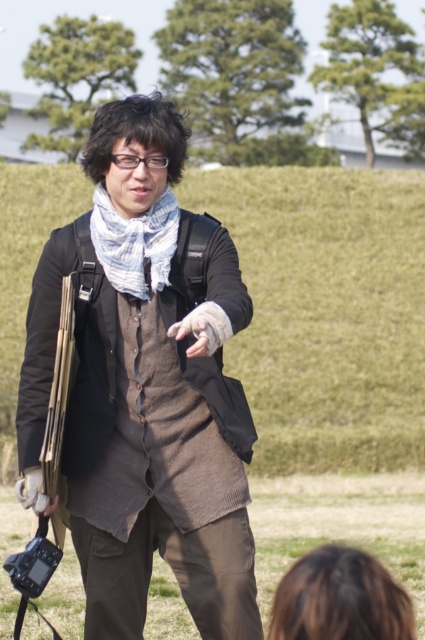
Can you confirm if knitted brown vest at center is positioned below white textured scarf at center?

Indeed, knitted brown vest at center is positioned under white textured scarf at center.

Does knitted brown vest at center have a smaller size compared to white textured scarf at center?

No.

The width and height of the screenshot is (425, 640). Describe the element at coordinates (156, 394) in the screenshot. I see `knitted brown vest at center` at that location.

In order to click on knitted brown vest at center in this screenshot , I will do `click(156, 394)`.

Can you confirm if knitted brown vest at center is smaller than leather glove at center?

No, knitted brown vest at center is not smaller than leather glove at center.

Based on the photo, who is higher up, knitted brown vest at center or leather glove at center?

leather glove at center is higher up.

Which is in front, point (243, 525) or point (192, 317)?

Point (192, 317) is in front.

Find the location of a particular element. The height and width of the screenshot is (640, 425). knitted brown vest at center is located at coordinates (156, 394).

Does white textured scarf at center appear on the left side of leather glove at center?

Indeed, white textured scarf at center is positioned on the left side of leather glove at center.

Locate an element on the screen. Image resolution: width=425 pixels, height=640 pixels. white textured scarf at center is located at coordinates (135, 243).

Who is more distant from viewer, (x=167, y=224) or (x=197, y=308)?

Point (x=167, y=224)

Locate an element on the screen. The height and width of the screenshot is (640, 425). white textured scarf at center is located at coordinates (135, 243).